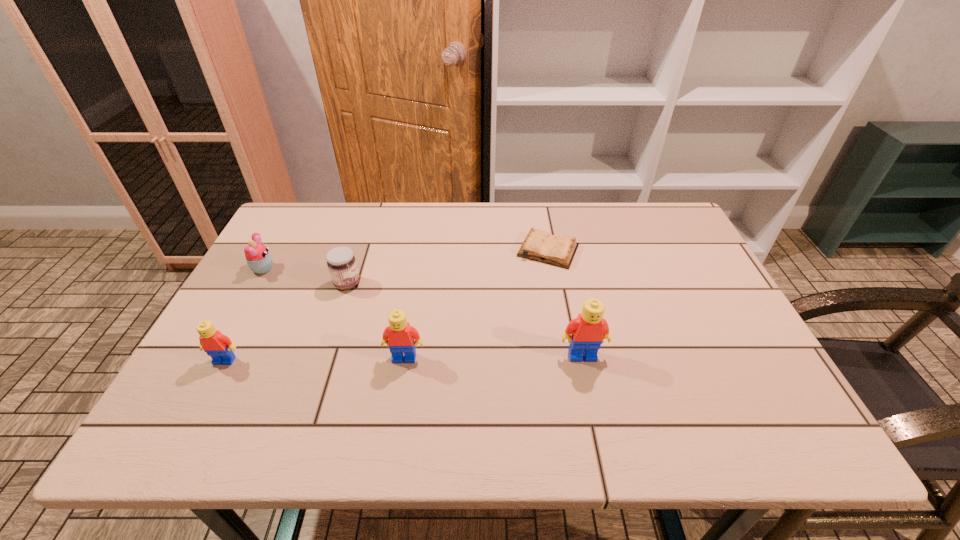
The Legos are evenly distributed in the image. To maintain this, where would you place another Lego on the right? Please point to a free space. Please provide its 2D coordinates. Your answer should be formatted as a tuple, i.e. [(x, y)], where the tuple contains the x and y coordinates of a point satisfying the conditions above.

[(758, 354)]